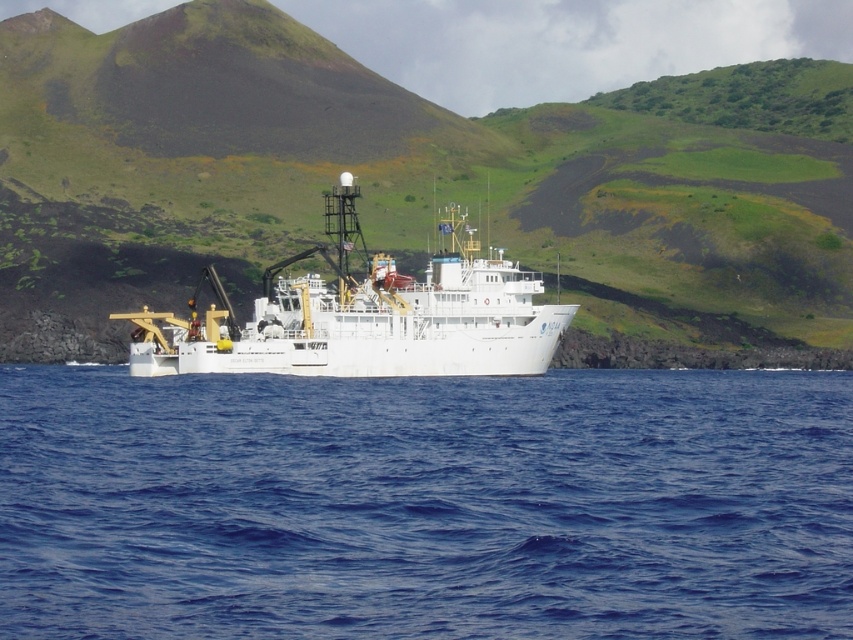
Is blue liquid water at center taller than green grassy hillside at center?

Incorrect, blue liquid water at center's height is not larger of green grassy hillside at center's.

Does blue liquid water at center appear over green grassy hillside at center?

No, blue liquid water at center is not above green grassy hillside at center.

Between point (701, 550) and point (368, 200), which one is positioned behind?

The point (368, 200) is more distant.

The width and height of the screenshot is (853, 640). In order to click on blue liquid water at center in this screenshot , I will do `click(425, 504)`.

Is green grassy hillside at center taller than white matte ship at center?

Indeed, green grassy hillside at center has a greater height compared to white matte ship at center.

Is point (373, 113) positioned in front of point (405, 298)?

No, it is not.

This screenshot has width=853, height=640. In order to click on green grassy hillside at center in this screenshot , I will do `click(416, 186)`.

Can you confirm if blue liquid water at center is wider than white matte ship at center?

Indeed, blue liquid water at center has a greater width compared to white matte ship at center.

Is blue liquid water at center to the left of white matte ship at center from the viewer's perspective?

No, blue liquid water at center is not to the left of white matte ship at center.

Which is in front, point (41, 508) or point (210, 316)?

Point (41, 508) is in front.

Find the location of `blue liquid water at center`. blue liquid water at center is located at coordinates (425, 504).